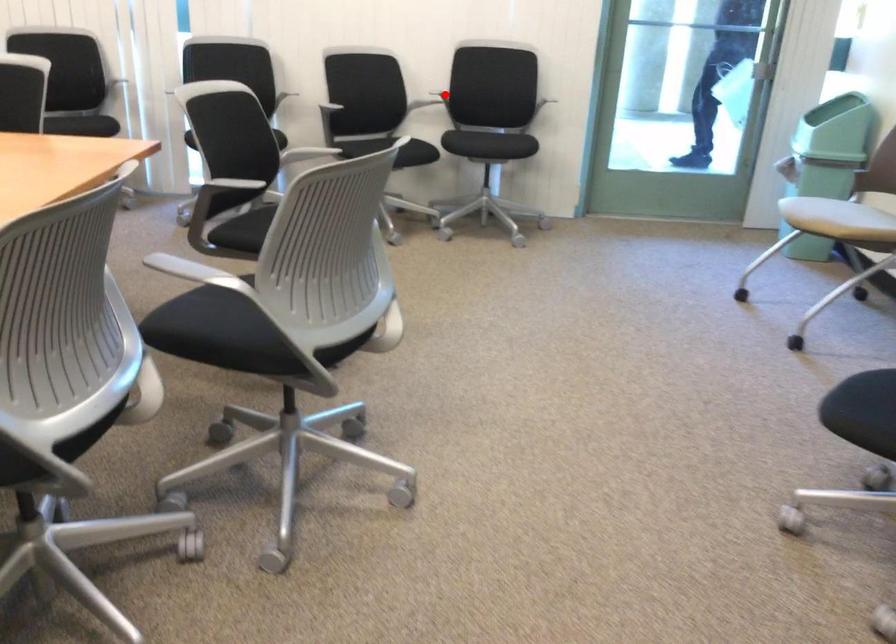
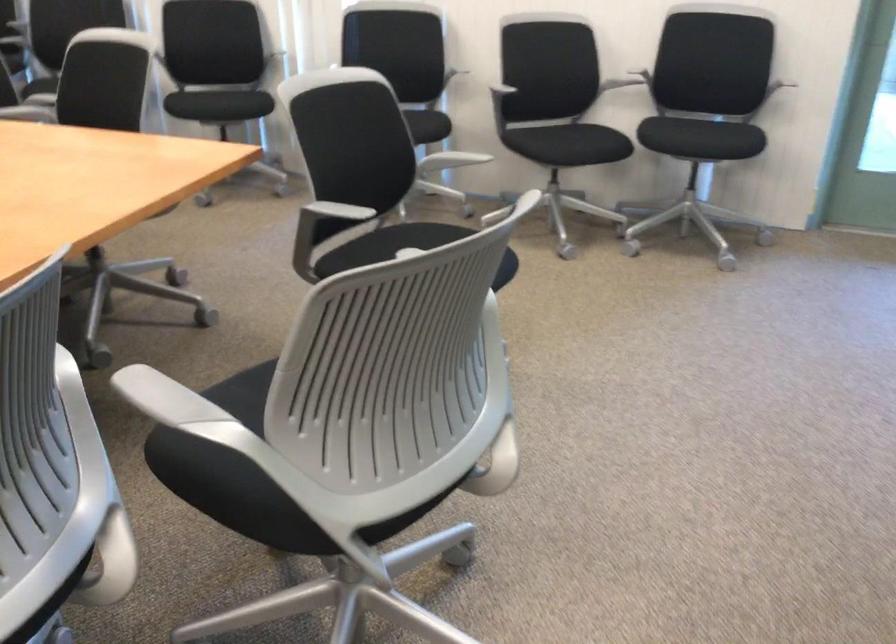
Question: I am providing you with two images of the same scene from different viewpoints. In image1, a red point is highlighted. Considering the same 3D point in image2, which of the following is correct?

Choices:
 (A) It is closer
 (B) It is farther

Answer: (A)